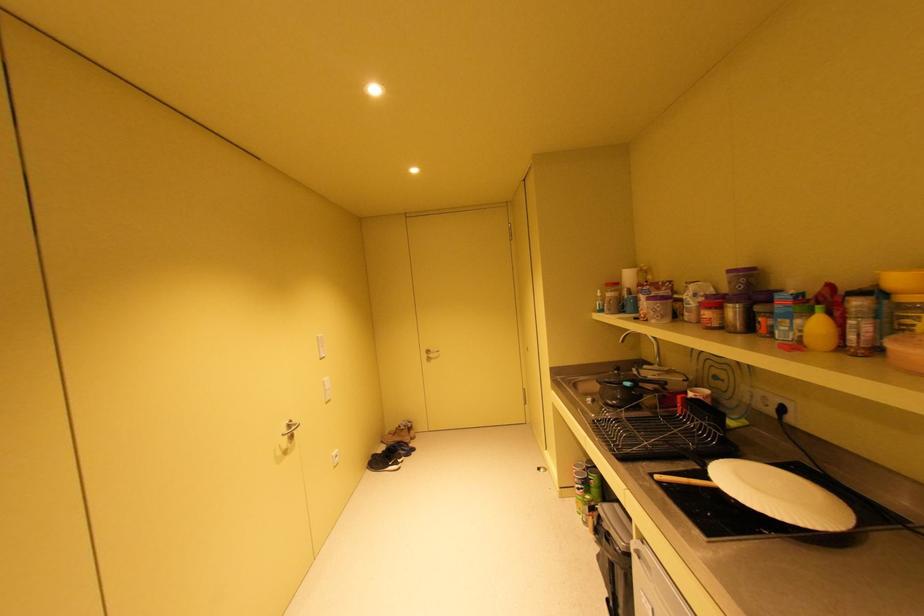
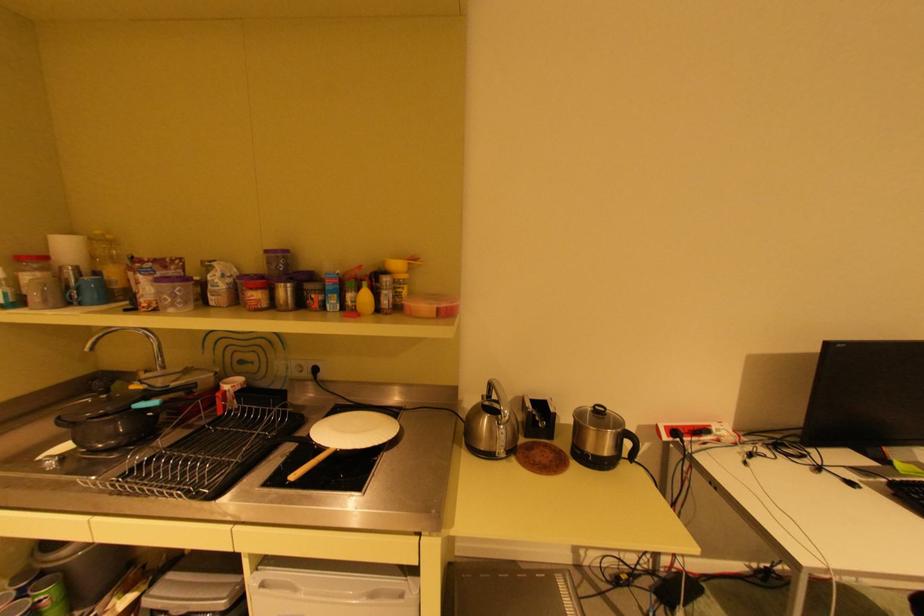
Find the pixel in the second image that matches the point at 630,312 in the first image.

(79, 302)